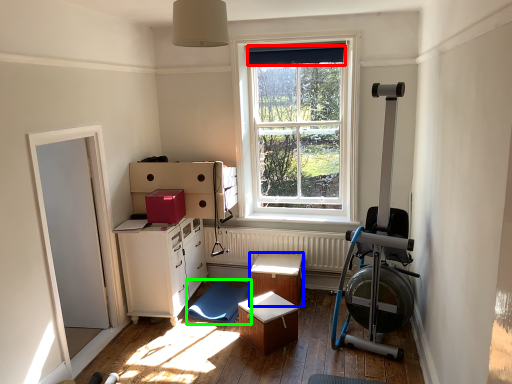
Question: Considering the real-world distances, which object is farthest from curtain (highlighted by a red box)? table (highlighted by a blue box) or swivel chair (highlighted by a green box)?

Choices:
 (A) table
 (B) swivel chair

Answer: (B)